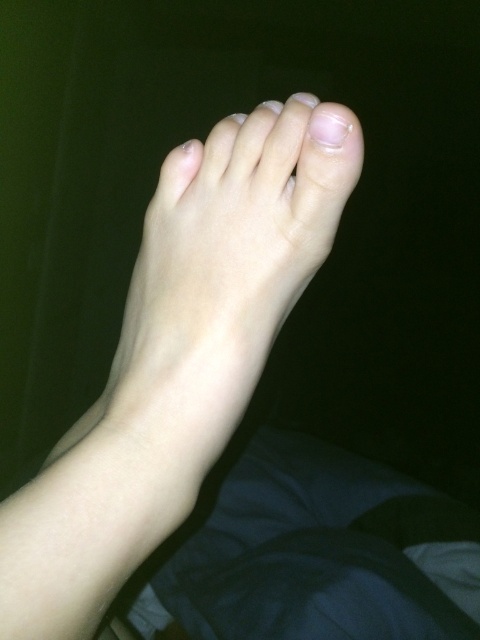
From the picture: You are a photographer trying to capture the texture of the toes in the image. Which toe, the clear skin toe at upper center or the smooth skin toe at upper center, is closer to the camera?

The clear skin toe at upper center is closer to the camera because it is in front of the smooth skin toe at upper center.

You are a foot model preparing for a photoshoot. The photographer wants to ensure there is at least 1 inch of space between the pale skin toe at center and the smooth skin toe at center to highlight their contrast. Based on the image provided, does the current positioning meet this requirement?

The distance between the pale skin toe at center and the smooth skin toe at center is 1.14 inches, which exceeds the required 1 inch. Therefore, the current positioning meets the photographer s requirement.